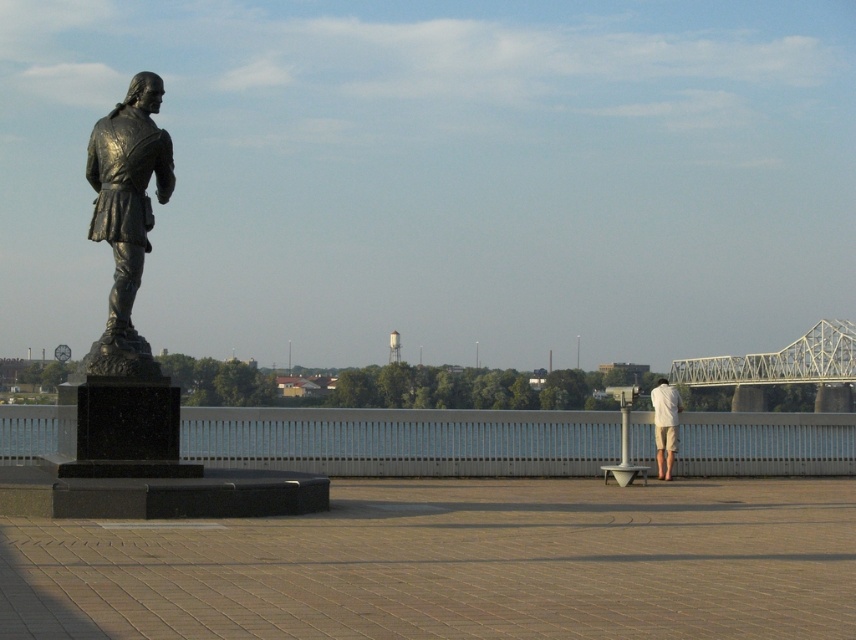
Does bronze statue at left have a lesser height compared to white metallic bridge at right?

No, bronze statue at left is not shorter than white metallic bridge at right.

Does bronze statue at left lie behind white metallic bridge at right?

That is False.

Which is behind, point (108, 317) or point (845, 336)?

Point (845, 336)

At what (x,y) coordinates should I click in order to perform the action: click on bronze statue at left. Please return your answer as a coordinate pair (x, y). Looking at the image, I should click on (126, 216).

Does bronze statue at left have a greater width compared to white cotton shorts at right?

Correct, the width of bronze statue at left exceeds that of white cotton shorts at right.

What do you see at coordinates (126, 216) in the screenshot?
I see `bronze statue at left` at bounding box center [126, 216].

Between point (125, 196) and point (661, 416), which one is positioned in front?

Positioned in front is point (125, 196).

The height and width of the screenshot is (640, 856). Find the location of `bronze statue at left`. bronze statue at left is located at coordinates (126, 216).

Looking at this image, is white metallic bridge at right wider than white cotton shorts at right?

Yes.

What do you see at coordinates (779, 362) in the screenshot? I see `white metallic bridge at right` at bounding box center [779, 362].

What do you see at coordinates (779, 362) in the screenshot? I see `white metallic bridge at right` at bounding box center [779, 362].

Where is `white metallic bridge at right`? The image size is (856, 640). white metallic bridge at right is located at coordinates (779, 362).